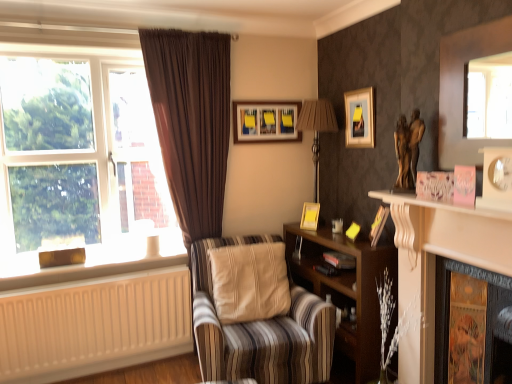
Question: Can you confirm if wooden picture frame at center, arranged as the 3th picture frame when viewed from the top, is thinner than matte yellow picture frame at upper right, the second picture frame when ordered from front to back?

Choices:
 (A) no
 (B) yes

Answer: (A)

Question: Is wooden picture frame at center, the third picture frame from the right, shorter than matte yellow picture frame at upper right, placed as the 3th picture frame when sorted from back to front?

Choices:
 (A) yes
 (B) no

Answer: (A)

Question: Is wooden picture frame at center, the third picture frame from the right, wider than matte yellow picture frame at upper right, placed as the 2th picture frame when sorted from right to left?

Choices:
 (A) no
 (B) yes

Answer: (B)

Question: Are wooden picture frame at center, the 2th picture frame from the bottom, and matte yellow picture frame at upper right, the 3th picture frame positioned from the left, making contact?

Choices:
 (A) no
 (B) yes

Answer: (A)

Question: Can you confirm if wooden picture frame at center, the 2th picture frame positioned from the left, is bigger than matte yellow picture frame at upper right, the second picture frame in the top-to-bottom sequence?

Choices:
 (A) yes
 (B) no

Answer: (B)

Question: From the image's perspective, is matte wooden picture frame at upper center, the 4th picture frame from the front, located above or below brown fabric curtain at left?

Choices:
 (A) below
 (B) above

Answer: (B)

Question: Does point (287, 134) appear closer or farther from the camera than point (187, 125)?

Choices:
 (A) farther
 (B) closer

Answer: (A)

Question: Visually, is matte wooden picture frame at upper center, the 4th picture frame from the front, positioned to the left or to the right of brown fabric curtain at left?

Choices:
 (A) right
 (B) left

Answer: (A)

Question: From a real-world perspective, is matte wooden picture frame at upper center, which appears as the first picture frame when viewed from the back, physically located above or below brown fabric curtain at left?

Choices:
 (A) above
 (B) below

Answer: (A)

Question: Is wooden picture frame at center, the 2th picture frame positioned from the left, inside the boundaries of clear glass window at left, or outside?

Choices:
 (A) inside
 (B) outside

Answer: (B)

Question: In the image, is wooden picture frame at center, placed as the third picture frame when sorted from front to back, on the left side or the right side of clear glass window at left?

Choices:
 (A) right
 (B) left

Answer: (A)

Question: Relative to clear glass window at left, is wooden picture frame at center, which ranks as the second picture frame in back-to-front order, in front or behind?

Choices:
 (A) behind
 (B) front

Answer: (A)

Question: Is point pyautogui.click(x=305, y=206) positioned closer to the camera than point pyautogui.click(x=57, y=231)?

Choices:
 (A) farther
 (B) closer

Answer: (A)

Question: From a real-world perspective, is white matte radiator at lower left physically located above or below black matte book at center?

Choices:
 (A) above
 (B) below

Answer: (B)

Question: In terms of height, does white matte radiator at lower left look taller or shorter compared to black matte book at center?

Choices:
 (A) tall
 (B) short

Answer: (A)